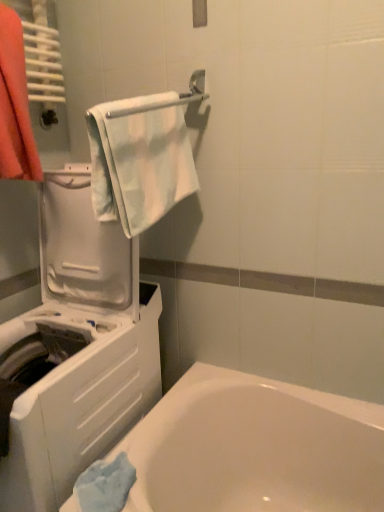
Question: Based on their sizes in the image, would you say white glossy towel bar at upper center is bigger or smaller than white plastic washing machine at left?

Choices:
 (A) small
 (B) big

Answer: (A)

Question: Does point (193, 92) appear closer or farther from the camera than point (112, 245)?

Choices:
 (A) closer
 (B) farther

Answer: (B)

Question: Based on their relative distances, which object is farther from the white plastic washing machine at left?

Choices:
 (A) orange cotton towel at left
 (B) light blue fabric towel at upper center
 (C) white glossy bathtub at lower left
 (D) white glossy towel bar at upper center

Answer: (D)

Question: Which is nearer to the orange cotton towel at left?

Choices:
 (A) white glossy towel bar at upper center
 (B) white glossy bathtub at lower left
 (C) white plastic washing machine at left
 (D) light blue fabric towel at upper center

Answer: (D)